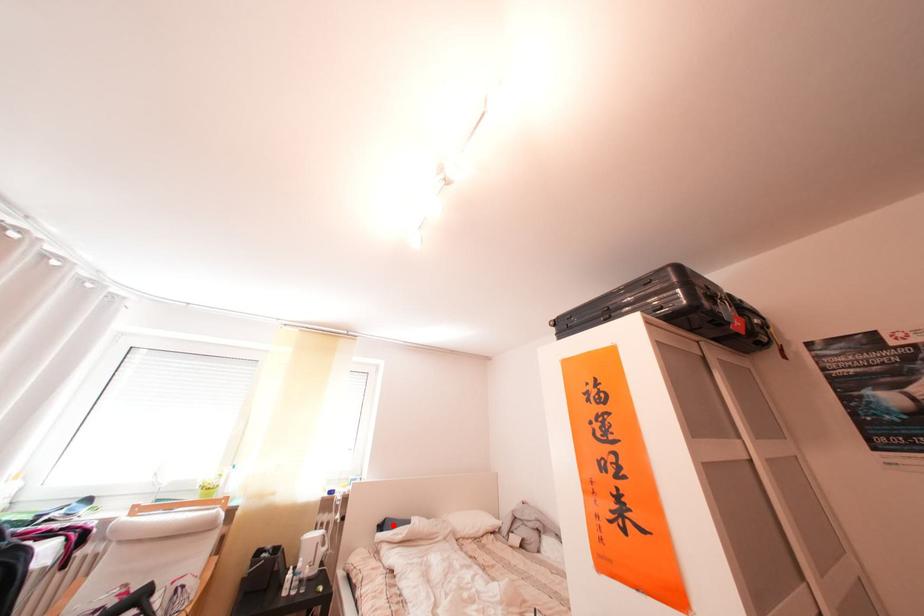
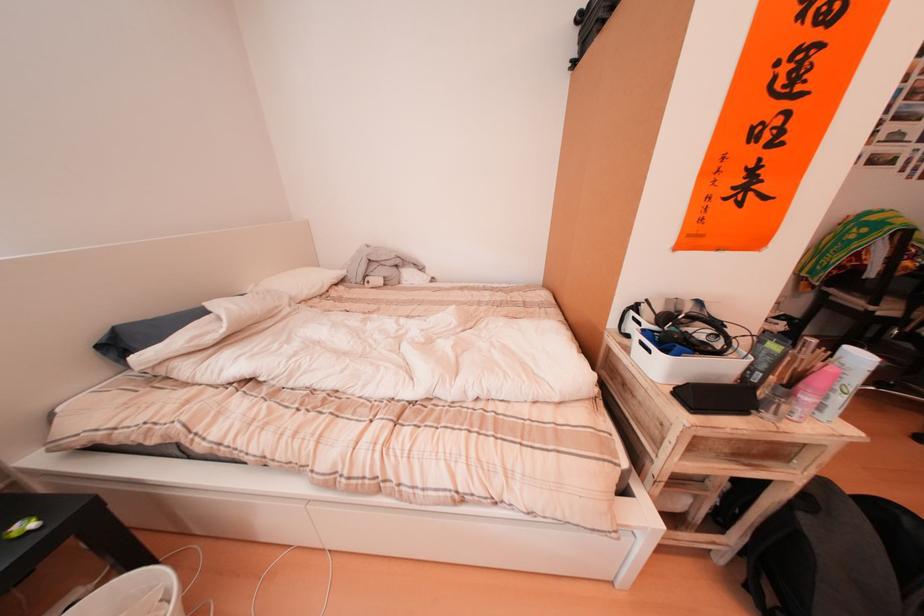
Locate, in the second image, the point that corresponds to the highlighted location in the first image.

(105, 339)